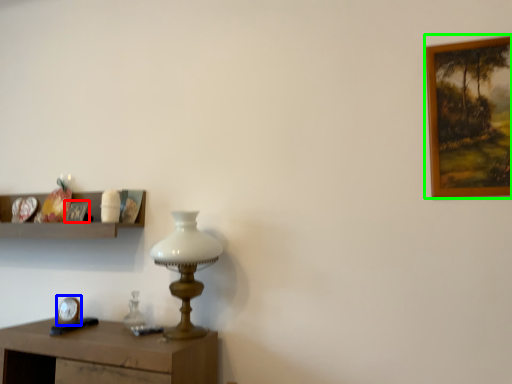
Question: Which object is the closest to the picture frame (highlighted by a red box)? Choose among these: clock (highlighted by a blue box) or picture frame (highlighted by a green box).

Choices:
 (A) clock
 (B) picture frame

Answer: (A)